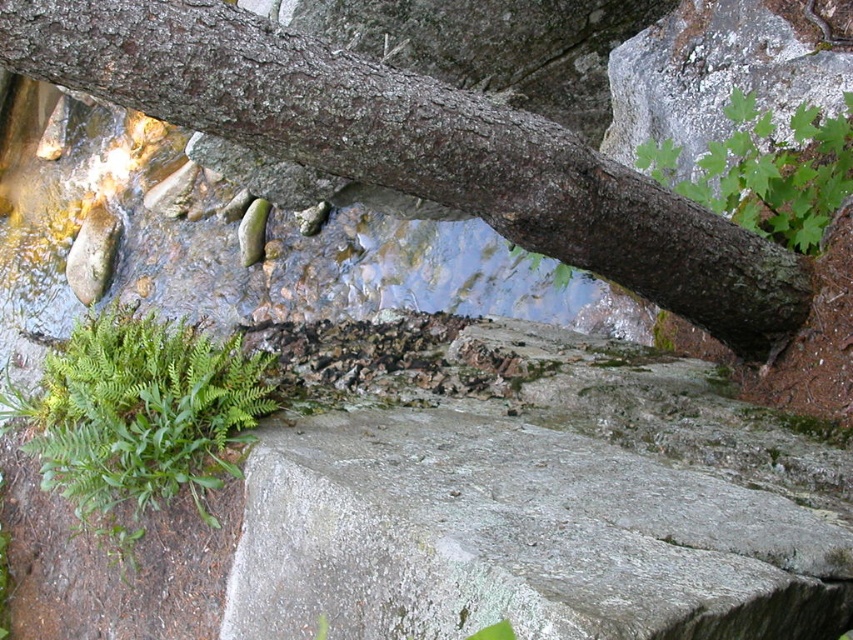
You are a hiker carrying a heavy backpack and want to cross the stream safely. You notice the gray rough concrete at center. Can you step on it without slipping?

The gray rough concrete at center is 3.88 feet away from you, so yes, you can step on it safely without slipping since concrete provides a stable surface even at that distance.

You are a hiker trying to cross the stream. You see the smooth brown tree trunk at upper center and the green leafy fern at upper right. Which object is positioned to the left when viewed from your perspective?

The smooth brown tree trunk at upper center is to the left of the green leafy fern at upper right.

You are a hiker trying to cross the stream in the image. You see the smooth brown tree trunk at upper center and the green leafy fern at upper right. Which object is closer to you, and can you use the tree trunk as a stepping stone?

The smooth brown tree trunk at upper center is closer to you than the green leafy fern at upper right. However, the tree trunk is lying across the frame and may not be stable enough to use as a stepping stone. It is advisable to look for rocks or other stable surfaces in the stream for safe crossing.